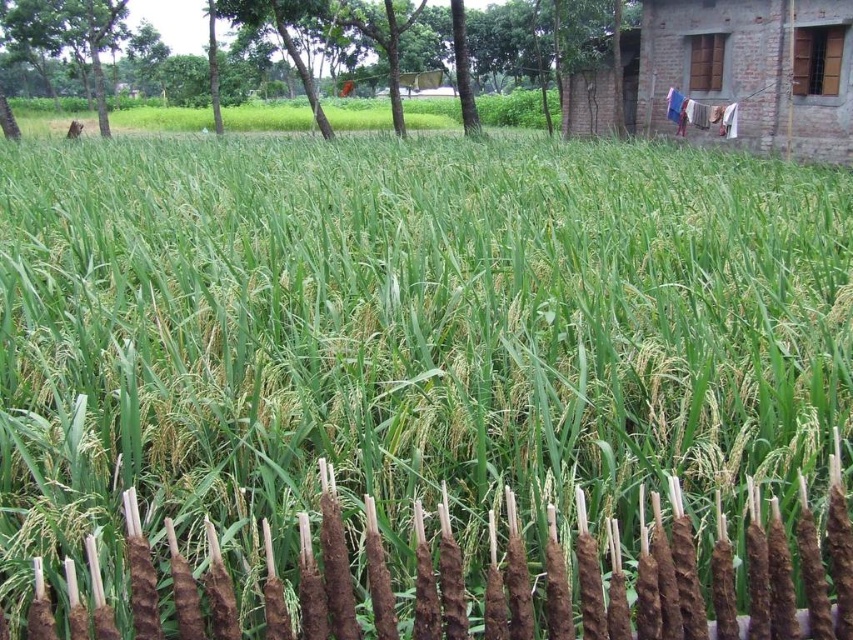
Question: Is brown clay fence at lower center closer to the viewer compared to brown brick hut at upper right?

Choices:
 (A) yes
 (B) no

Answer: (A)

Question: Which point is farther to the camera?

Choices:
 (A) (303, 630)
 (B) (218, 4)
 (C) (601, 132)

Answer: (C)

Question: Among these points, which one is farthest from the camera?

Choices:
 (A) (579, 84)
 (B) (434, 60)
 (C) (186, 582)

Answer: (B)

Question: Can you confirm if brown brick hut at upper right is wider than green leafy tree at upper center?

Choices:
 (A) no
 (B) yes

Answer: (A)

Question: Which is nearer to the brown brick hut at upper right?

Choices:
 (A) brown clay fence at lower center
 (B) green leafy tree at upper center

Answer: (A)

Question: Can you confirm if brown clay fence at lower center is positioned below green leafy tree at upper center?

Choices:
 (A) no
 (B) yes

Answer: (B)